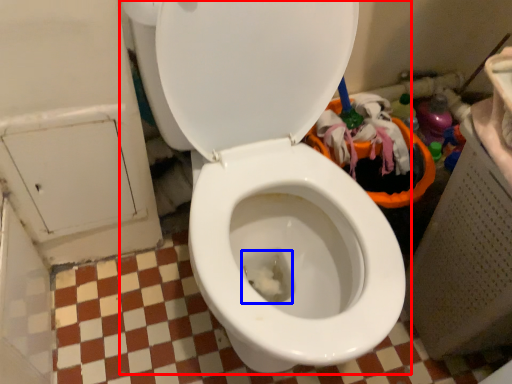
Question: Which point is closer to the camera, toilet (highlighted by a red box) or dust (highlighted by a blue box)?

Choices:
 (A) toilet
 (B) dust

Answer: (A)